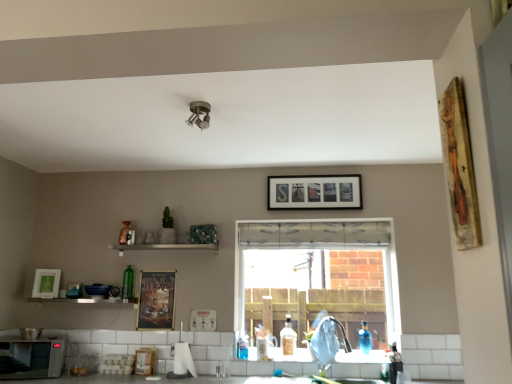
Find the location of a particular element. Image resolution: width=512 pixels, height=384 pixels. empty space that is ontop of wooden framed letters at upper center, the 2th picture frame when ordered from top to bottom is located at coordinates (314, 171).